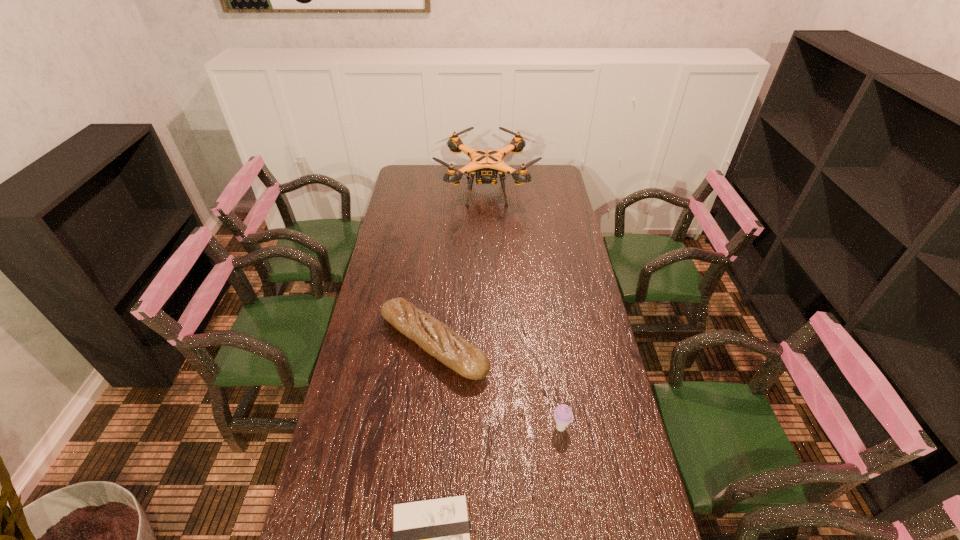
This screenshot has width=960, height=540. Identify the location of vacant region located on the right of the third nearest object. (560, 344).

I want to click on object located in the far edge section of the desktop, so click(486, 163).

Where is `object positioned at the left edge`? The height and width of the screenshot is (540, 960). object positioned at the left edge is located at coordinates (438, 340).

The image size is (960, 540). What are the coordinates of `drone that is positioned at the right edge` in the screenshot? It's located at (486, 163).

Image resolution: width=960 pixels, height=540 pixels. In order to click on icecream at the right edge in this screenshot , I will do `click(563, 416)`.

I want to click on object located at the far right corner, so click(486, 163).

Find the location of `free region at the left edge`. free region at the left edge is located at coordinates (361, 420).

Find the location of a particular element. free region at the right edge of the desktop is located at coordinates (605, 364).

I want to click on vacant space in between the third nearest object and the drone, so click(x=460, y=267).

Locate an element on the screen. This screenshot has width=960, height=540. free space that is in between the third shortest object and the third tallest object is located at coordinates (496, 386).